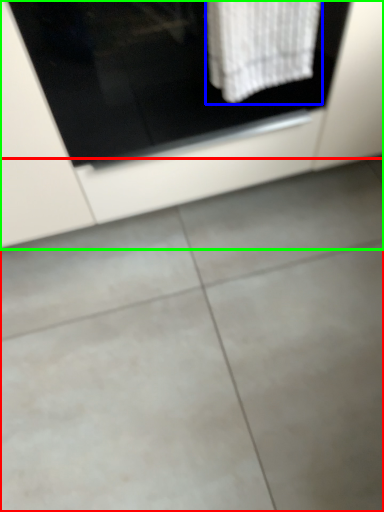
Question: Considering the real-world distances, which object is farthest from concrete (highlighted by a red box)? bath towel (highlighted by a blue box) or cabinetry (highlighted by a green box)?

Choices:
 (A) bath towel
 (B) cabinetry

Answer: (A)